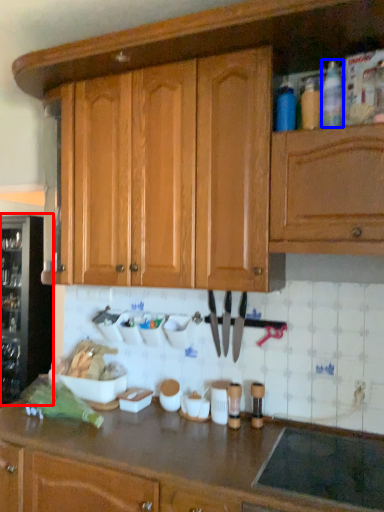
Question: Which of the following is the closest to the observer, wine cooler (highlighted by a red box) or bottle (highlighted by a blue box)?

Choices:
 (A) wine cooler
 (B) bottle

Answer: (B)